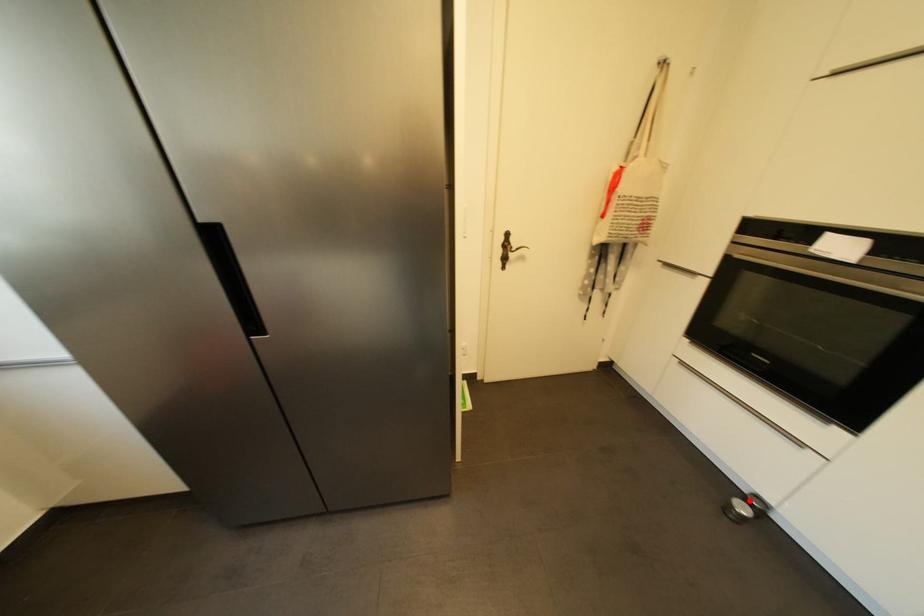
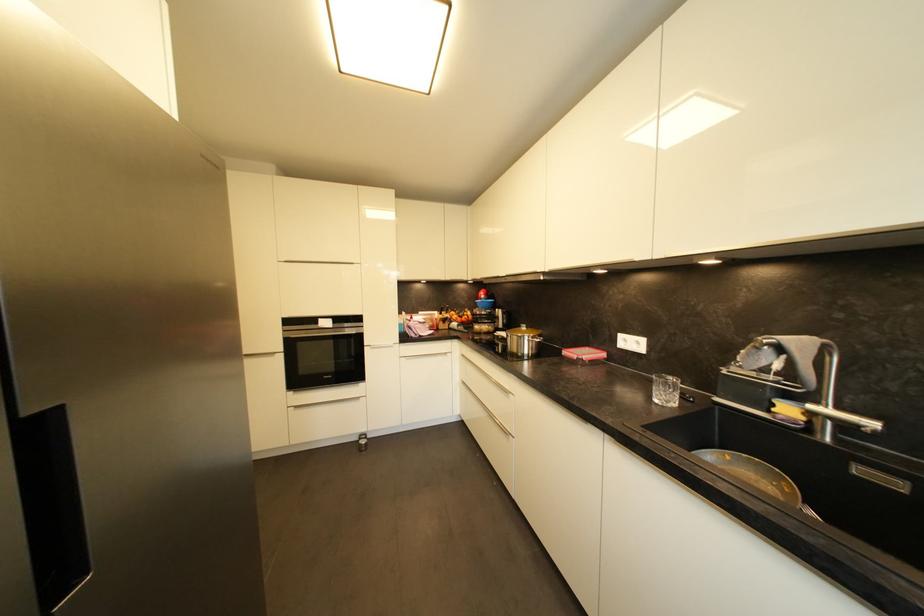
Locate, in the second image, the point that corresponds to the highlighted location in the first image.

(365, 440)